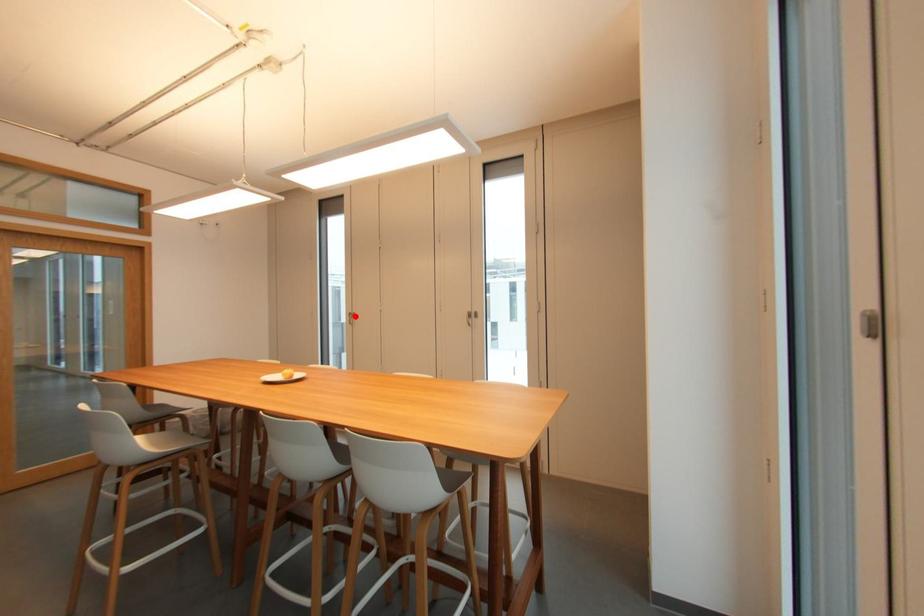
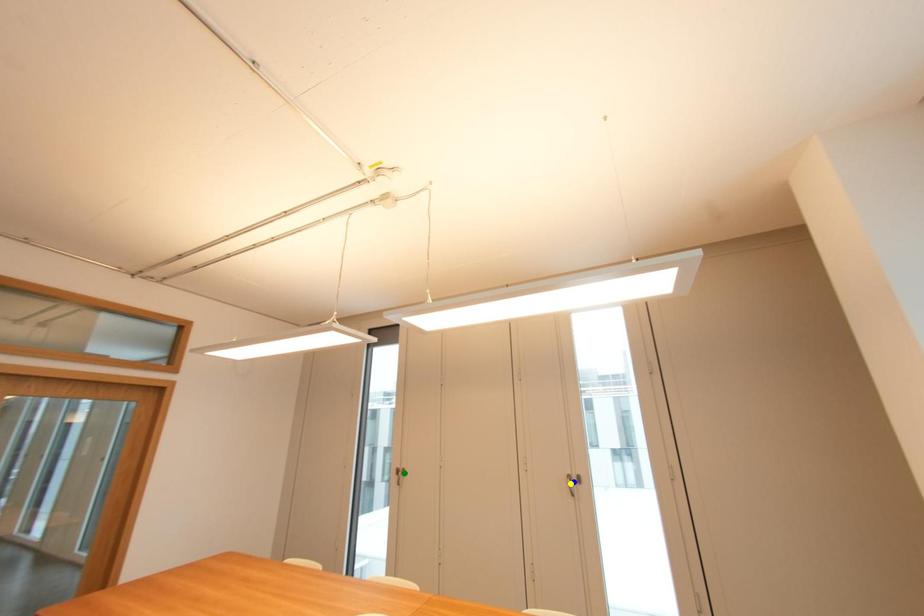
Question: I am providing you with two images of the same scene from different viewpoints. A red point is marked on the first image. You are given multiple points on the second image. Can you choose the point in image 2 that corresponds to the point in image 1?

Choices:
 (A) blue point
 (B) yellow point
 (C) green point

Answer: (C)